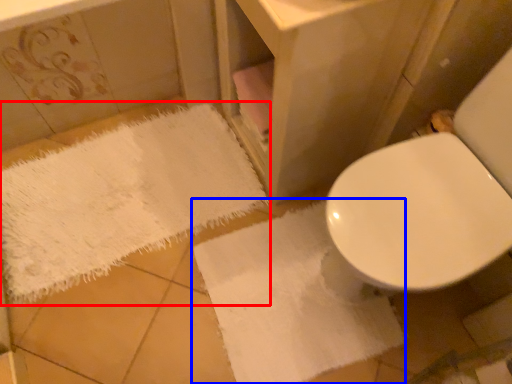
Question: Which object appears closest to the camera in this image, bath towel (highlighted by a red box) or bath towel (highlighted by a blue box)?

Choices:
 (A) bath towel
 (B) bath towel

Answer: (B)